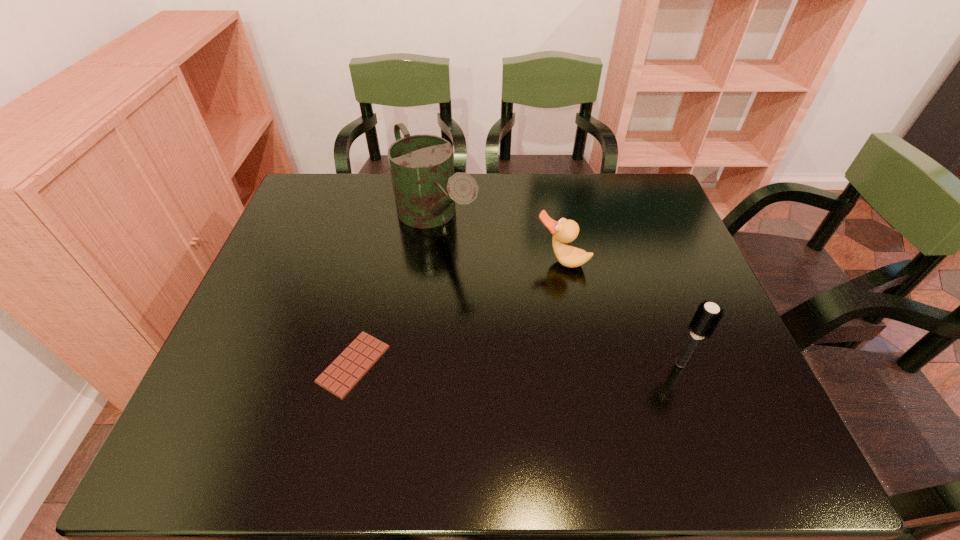
You are a GUI agent. You are given a task and a screenshot of the screen. Output one action in this format:
    pyautogui.click(x=<x>, y=<y>)
    Task: Click on the shortest object
    The height and width of the screenshot is (540, 960).
    Given the screenshot: What is the action you would take?
    pyautogui.click(x=353, y=363)

Image resolution: width=960 pixels, height=540 pixels. I want to click on the rightmost object, so click(x=708, y=315).

Locate an element on the screen. the second tallest object is located at coordinates (708, 315).

The height and width of the screenshot is (540, 960). I want to click on the tallest object, so click(425, 187).

At what (x,y) coordinates should I click in order to perform the action: click on the third tallest object. Please return your answer as a coordinate pair (x, y). Looking at the image, I should click on (565, 231).

Find the location of a particular element. This screenshot has height=540, width=960. the third object from left to right is located at coordinates (565, 231).

Identify the location of vacant space situated on the right of the candy bar. The height and width of the screenshot is (540, 960). (516, 364).

Where is `free location located 0.080m on the right of the hairbrush`? This screenshot has width=960, height=540. free location located 0.080m on the right of the hairbrush is located at coordinates (729, 363).

You are a GUI agent. You are given a task and a screenshot of the screen. Output one action in this format:
    pyautogui.click(x=<x>, y=<y>)
    Task: Click on the vacant space located 0.380m with the spout on the tallest object
    
    Given the screenshot: What is the action you would take?
    pyautogui.click(x=538, y=362)

The height and width of the screenshot is (540, 960). In order to click on blank space located with the spout on the tallest object in this screenshot , I will do pos(538,362).